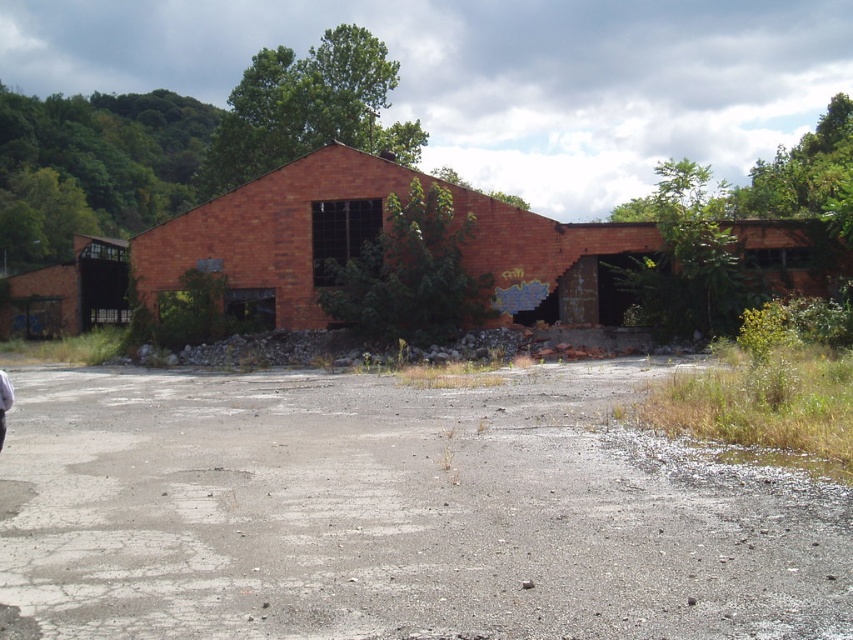
Question: Is red brick building at center positioned at the back of white fabric at lower left?

Choices:
 (A) no
 (B) yes

Answer: (B)

Question: Does brick wall barn at left have a greater width compared to white fabric at lower left?

Choices:
 (A) yes
 (B) no

Answer: (A)

Question: Which point is farther to the camera?

Choices:
 (A) gray asphalt at center
 (B) red brick building at center
 (C) brick wall barn at left

Answer: (C)

Question: Which object is the closest to the brick wall barn at left?

Choices:
 (A) gray asphalt at center
 (B) white fabric at lower left
 (C) red brick building at center

Answer: (C)

Question: Can you confirm if red brick building at center is positioned to the left of brick wall barn at left?

Choices:
 (A) yes
 (B) no

Answer: (B)

Question: Which object appears farthest from the camera in this image?

Choices:
 (A) white fabric at lower left
 (B) brick wall barn at left
 (C) red brick building at center

Answer: (B)